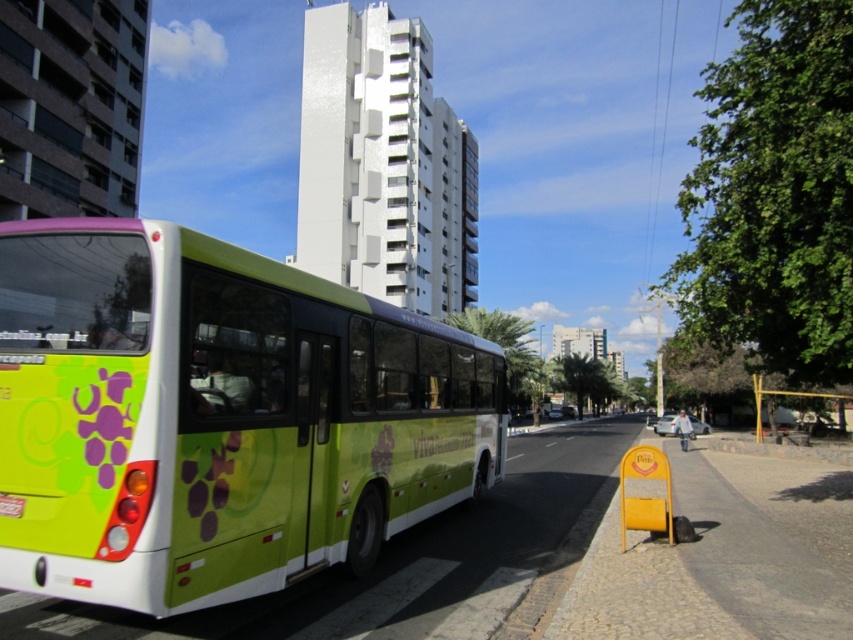
You are a passenger waiting at the metallic yellow bus stop at lower right and want to board the green matte bus at left. Is the bus currently in a position where you can easily board it from the bus stop?

The green matte bus at left is in front of the metallic yellow bus stop at lower right, so the bus is blocking access to the bus stop. You may need to wait until the bus moves to board.

You are standing at the center of the image. If you look towards the green matte bus at left, in which direction should you turn your head to see it?

Since the green matte bus at left is located at point (218, 417), which is on the left side of the image, you should turn your head to the left to see it.

You are standing at the point with coordinates point (666, 509) on the sidewalk. You want to walk to the point with coordinates point (163, 577). Which direction should you face to walk towards your destination?

You should face forward because point (163, 577) is in front of point (666, 509).